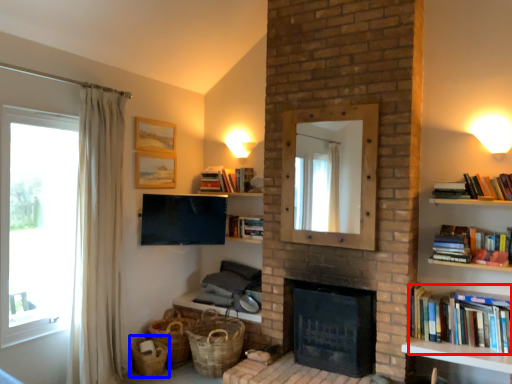
Question: Which object appears closest to the camera in this image, book (highlighted by a red box) or basket (highlighted by a blue box)?

Choices:
 (A) book
 (B) basket

Answer: (A)